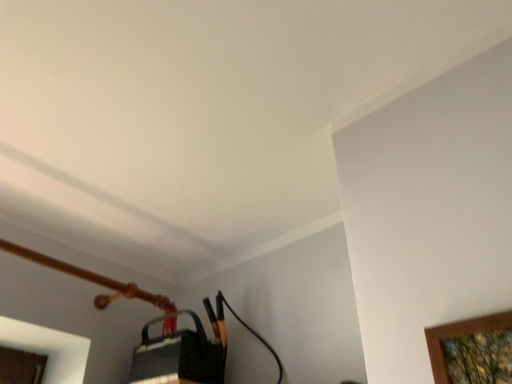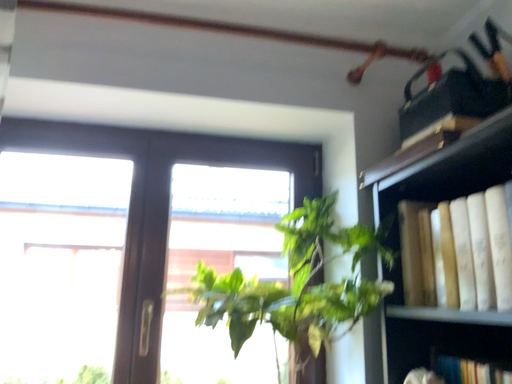
Question: How did the camera likely rotate when shooting the video?

Choices:
 (A) rotated downward
 (B) rotated upward

Answer: (A)